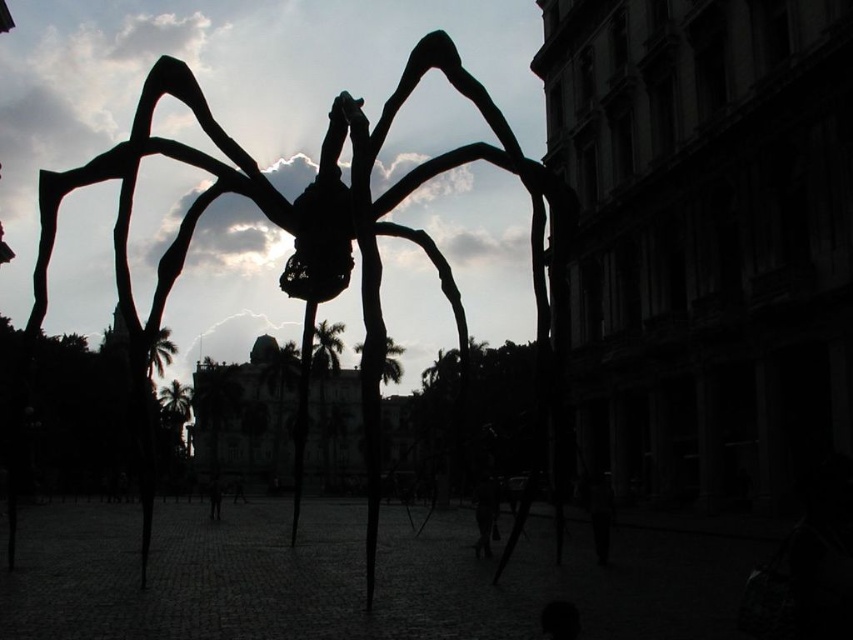
You are a security guard at the public square and notice a dark fabric bag at center and a dark skin human at center. Which object is taller?

The dark skin human at center is taller than the dark fabric bag at center.

You are standing at a distance and want to take a photo of the silhouette metal spider at center. If you are currently 156.30 feet away from it, can you fit the entire sculpture into your camera frame without moving closer?

The silhouette metal spider at center is 156.30 feet away from the camera. Whether it fits in the frame depends on the camera lens and sensor size, but at this distance, it might require a wide angle lens to capture the entire sculpture.

You are standing in the public square and want to take a photo of both the silhouette metal spider at center and the dark skin human at center. Which object should you focus on first to ensure both are in sharp focus?

You should focus on the silhouette metal spider at center first because it is closer to you than the dark skin human at center. By focusing on the closer object, the farther object may still be in acceptable focus depending on the camera settings.